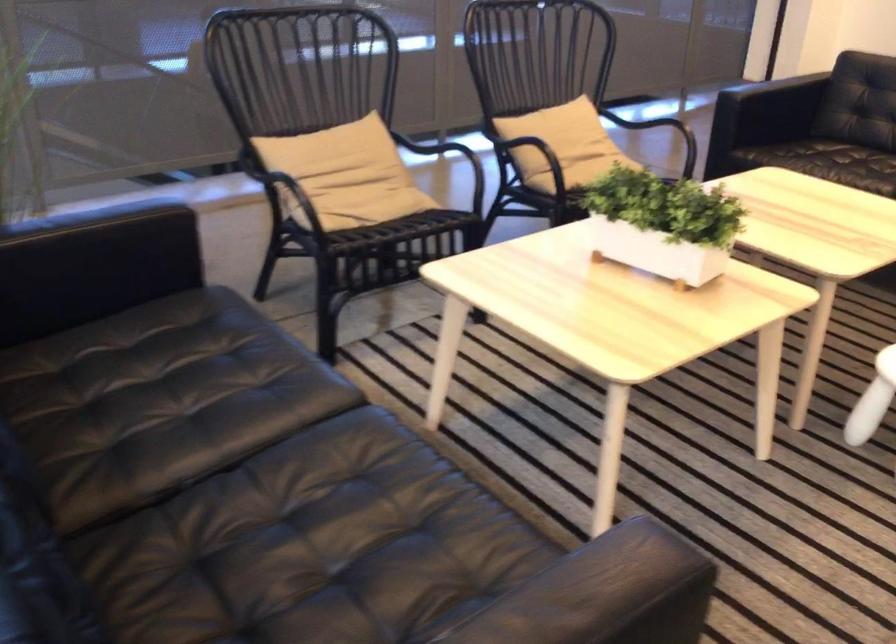
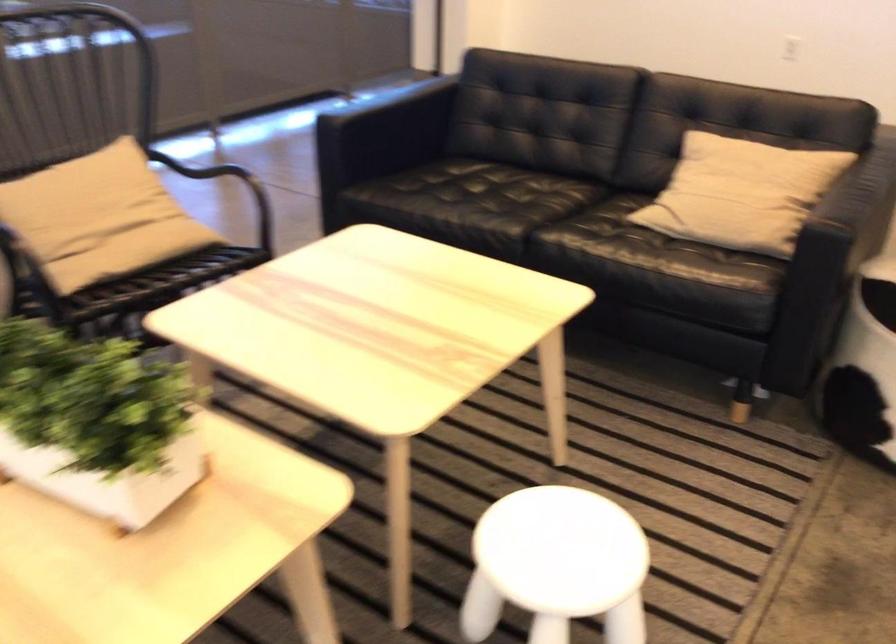
In the second image, find the point that corresponds to point (570, 134) in the first image.

(99, 214)